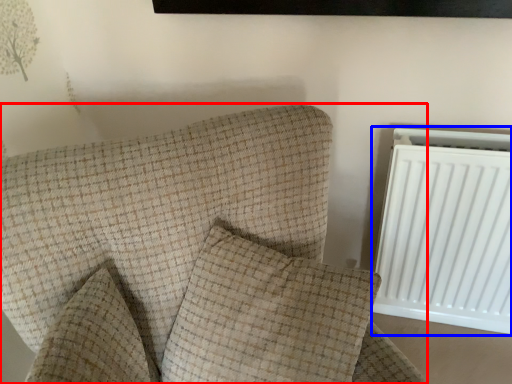
Question: Which of the following is the farthest to the observer, furniture (highlighted by a red box) or radiator (highlighted by a blue box)?

Choices:
 (A) furniture
 (B) radiator

Answer: (B)